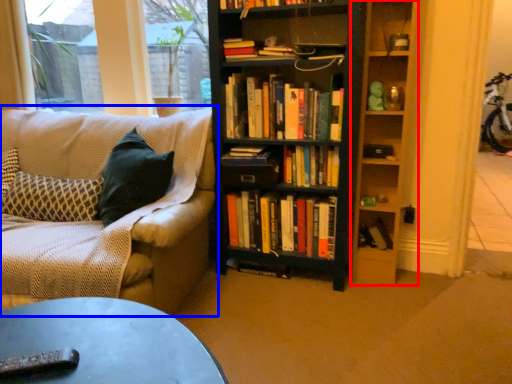
Question: Which of the following is the farthest to the observer, shelf (highlighted by a red box) or studio couch (highlighted by a blue box)?

Choices:
 (A) shelf
 (B) studio couch

Answer: (A)